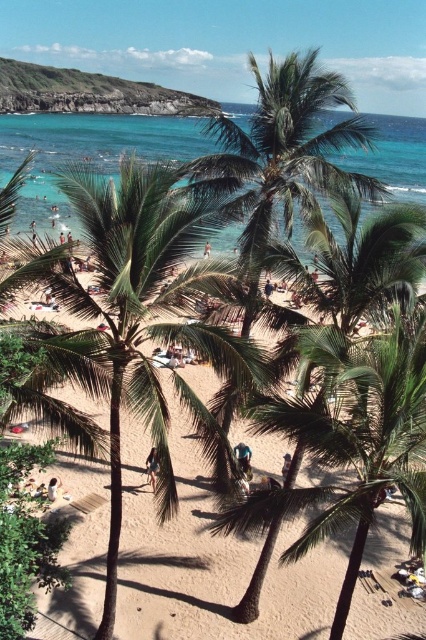
Question: In this image, where is light brown sandy beach at center located relative to blue denim shorts at center?

Choices:
 (A) right
 (B) left

Answer: (B)

Question: Among these points, which one is farthest from the camera?

Choices:
 (A) (244, 458)
 (B) (268, 291)
 (C) (149, 454)

Answer: (B)

Question: Which point is farther to the camera?

Choices:
 (A) (154, 474)
 (B) (379, 160)

Answer: (B)

Question: Does light brown leather surfboard at center appear under light blue fabric at center?

Choices:
 (A) no
 (B) yes

Answer: (A)

Question: Can you confirm if light brown sandy beach at center is bigger than light blue fabric at center?

Choices:
 (A) no
 (B) yes

Answer: (B)

Question: Which object appears closest to the camera in this image?

Choices:
 (A) light blue fabric at center
 (B) tan skin person at center
 (C) blue denim shorts at center
 (D) light brown sandy beach at center

Answer: (D)